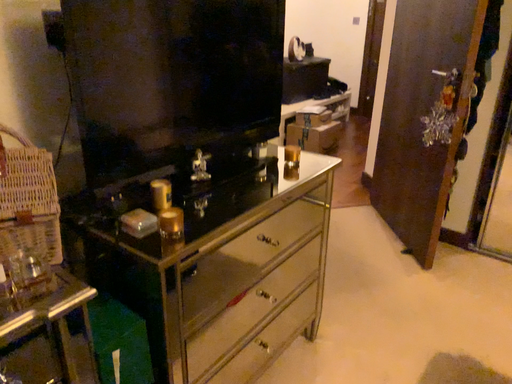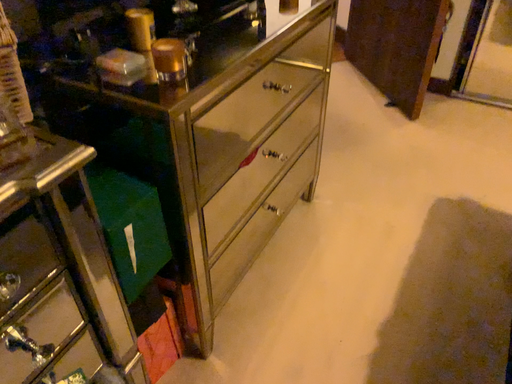
Question: Which way did the camera rotate in the video?

Choices:
 (A) rotated left
 (B) rotated right

Answer: (B)